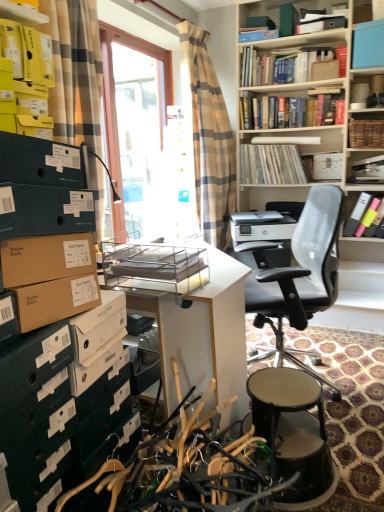
Where is `vacant point above matte white storage box at upper center (from a real-world perspective)`? This screenshot has width=384, height=512. vacant point above matte white storage box at upper center (from a real-world perspective) is located at coordinates (329, 150).